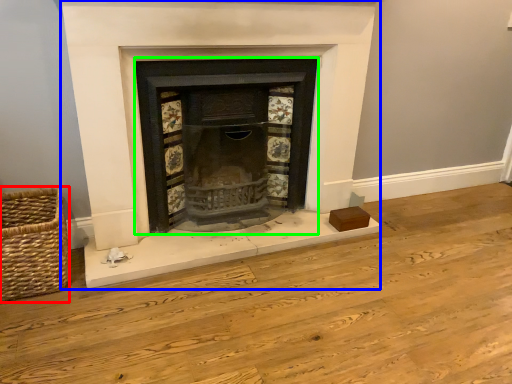
Question: Considering the real-world distances, which object is closest to basket (highlighted by a red box)? fireplace (highlighted by a blue box) or wood burning stove (highlighted by a green box).

Choices:
 (A) fireplace
 (B) wood burning stove

Answer: (A)